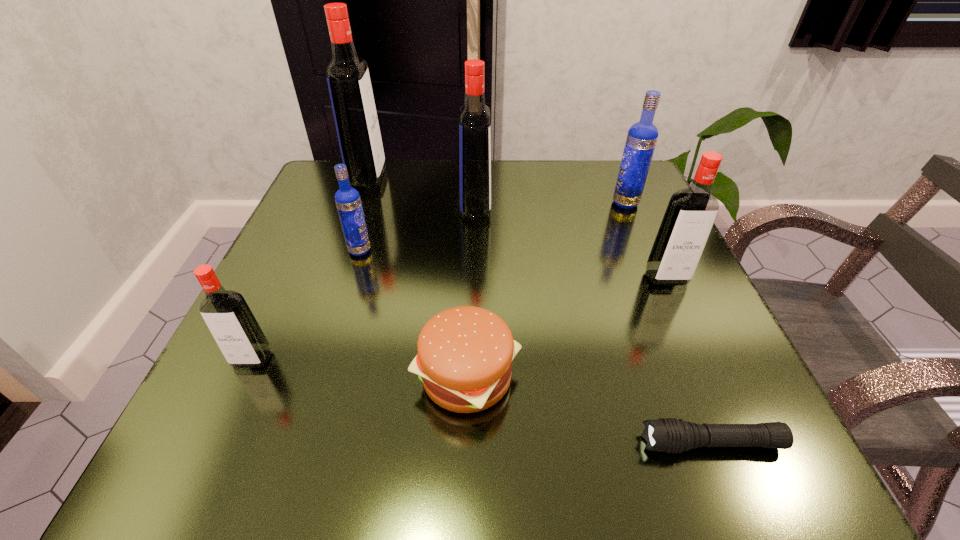
At what (x,y) coordinates should I click in order to perform the action: click on vodka that is the fifth nearest to the fourth nearest object. Please return your answer as a coordinate pair (x, y). Looking at the image, I should click on (236, 331).

Point out which red vodka is positioned as the fourth nearest to the flashlight. Please provide its 2D coordinates. Your answer should be formatted as a tuple, i.e. [(x, y)], where the tuple contains the x and y coordinates of a point satisfying the conditions above.

[(349, 84)]

Identify which red vodka is the second nearest to the third smallest red vodka. Please provide its 2D coordinates. Your answer should be formatted as a tuple, i.e. [(x, y)], where the tuple contains the x and y coordinates of a point satisfying the conditions above.

[(691, 212)]

Identify the location of free space that satisfies the following two spatial constraints: 1. on the front and back of the tallest object; 2. on the left side of the bigger blue vodka. Image resolution: width=960 pixels, height=540 pixels. (359, 203).

You are a GUI agent. You are given a task and a screenshot of the screen. Output one action in this format:
    pyautogui.click(x=<x>, y=<y>)
    Task: Click on the vacant space that satisfies the following two spatial constraints: 1. on the front and back of the farthest vodka; 2. on the front and back of the nearest vodka
    
    Given the screenshot: What is the action you would take?
    pyautogui.click(x=302, y=359)

Image resolution: width=960 pixels, height=540 pixels. I want to click on free space that satisfies the following two spatial constraints: 1. on the front and back of the third red vodka from left to right; 2. on the front and back of the leftmost vodka, so click(473, 359).

Locate an element on the screen. Image resolution: width=960 pixels, height=540 pixels. free space that satisfies the following two spatial constraints: 1. on the front and back of the hamburger; 2. on the right side of the leftmost object is located at coordinates (244, 376).